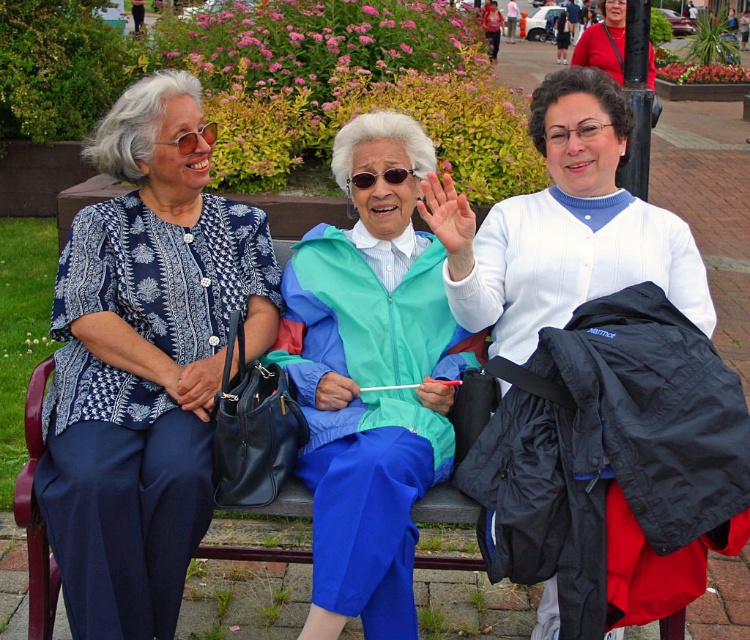
You are a fashion designer observing the women on the bench. You need to determine which of the two jackets, the teal matte jacket at center or the white matte cardigan at center, would require less fabric to produce. Based on their sizes, which one would need less material?

The teal matte jacket at center is smaller than the white matte cardigan at center, so it would require less fabric to produce.

You are a fashion designer observing the three women on the bench. You need to determine which of the two items, the matte blue blouse at left or the teal matte jacket at center, is narrower in width. Which one is narrower?

The matte blue blouse at left is narrower in width compared to the teal matte jacket at center according to the description.